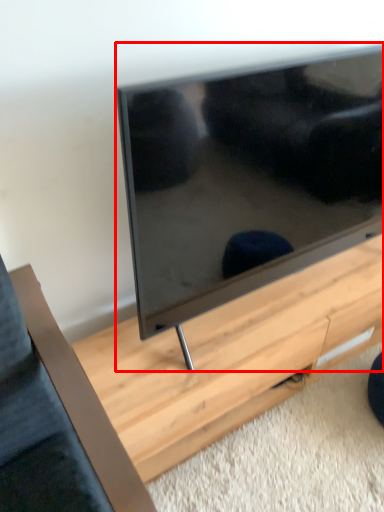
Question: Where is television (annotated by the red box) located in relation to table in the image?

Choices:
 (A) right
 (B) left

Answer: (B)